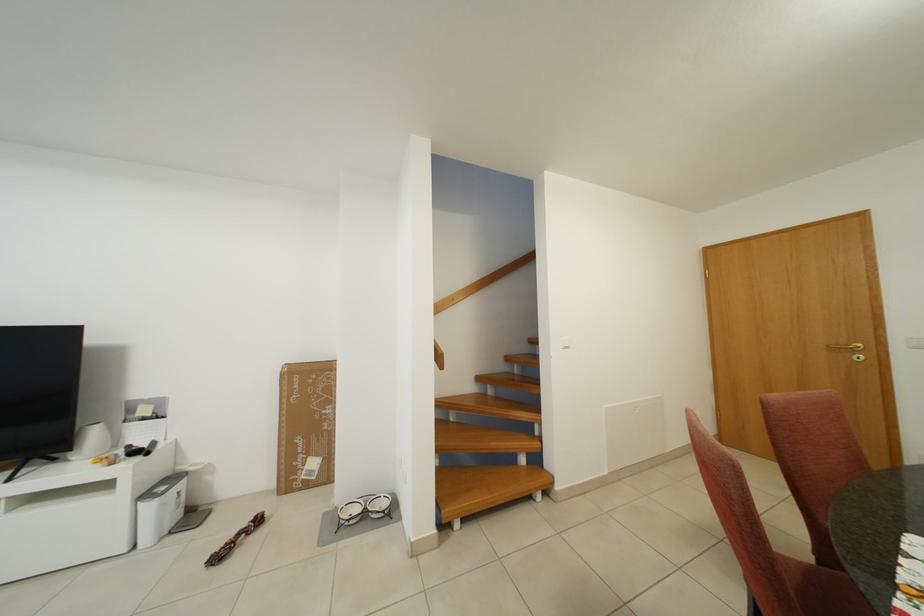
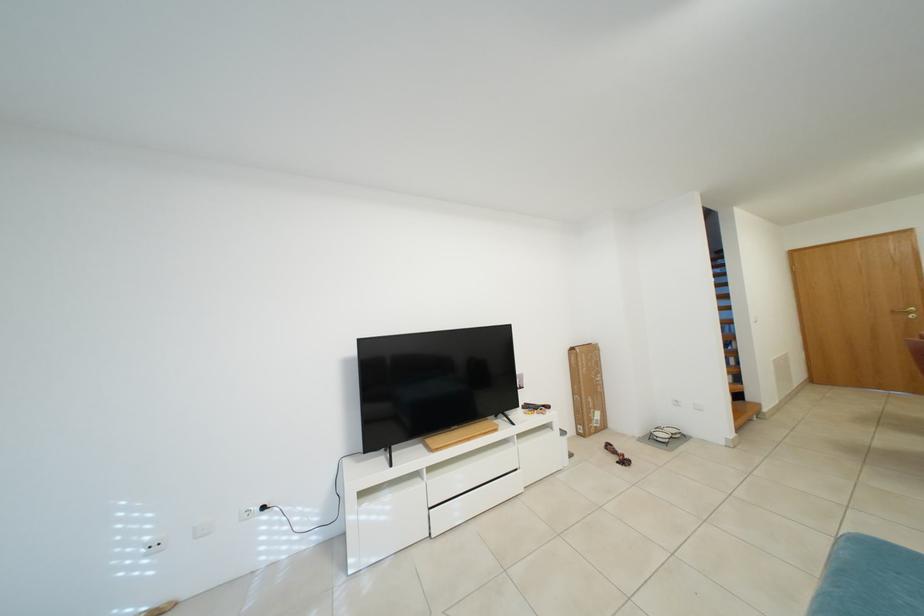
Where in the second image is the point corresponding to point (266, 525) from the first image?

(617, 451)